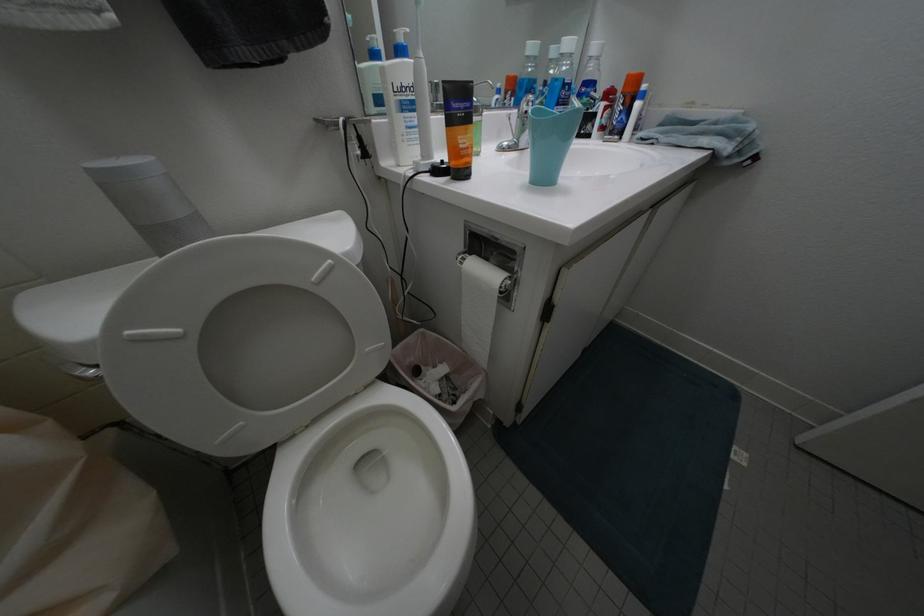
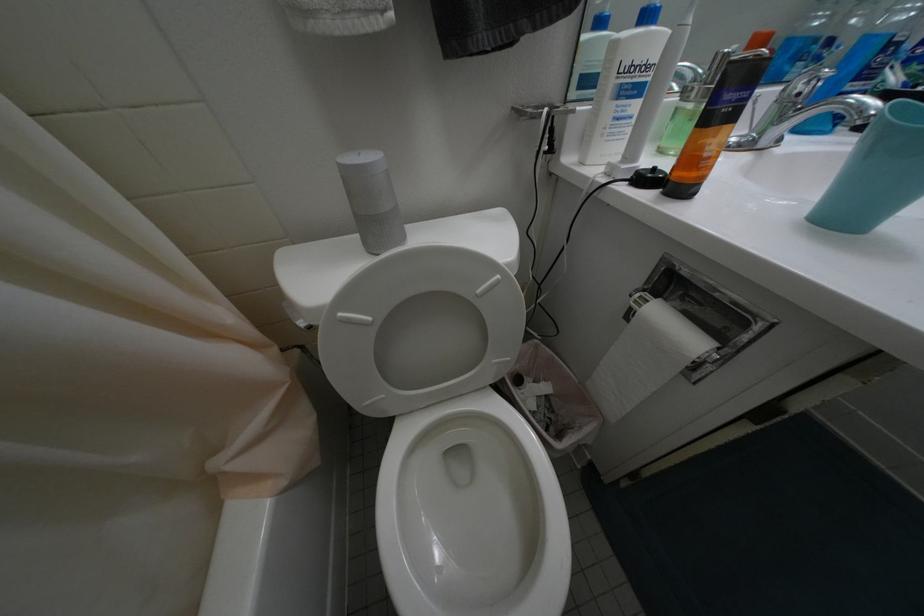
Question: The camera is either moving clockwise (left) or counter-clockwise (right) around the object. The first image is from the beginning of the video and the second image is from the end. Is the camera moving left or right when shooting the video?

Choices:
 (A) Left
 (B) Right

Answer: (B)